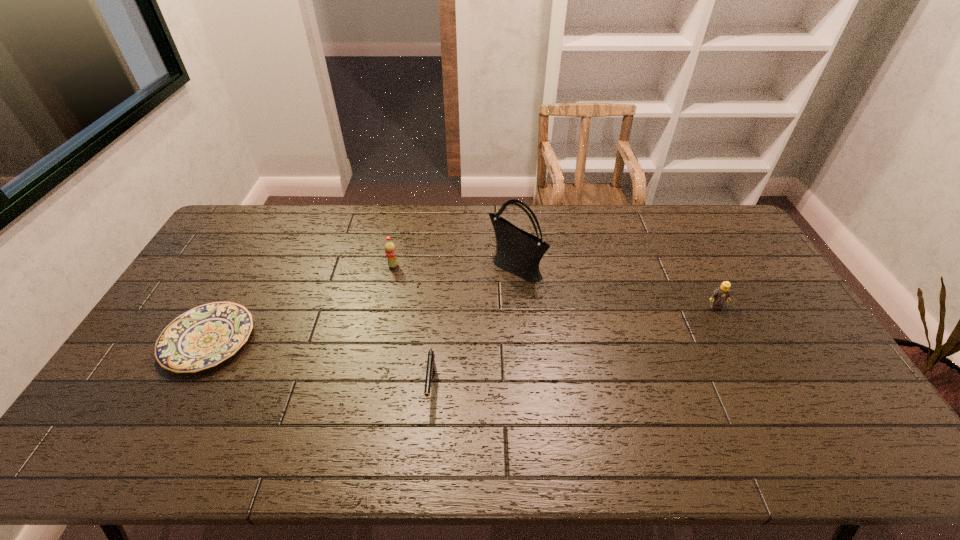
Identify the location of unoccupied area between the rightmost object and the pistol. The image size is (960, 540). (573, 347).

Locate an element on the screen. The height and width of the screenshot is (540, 960). empty space between the tallest object and the pistol is located at coordinates (473, 328).

You are a GUI agent. You are given a task and a screenshot of the screen. Output one action in this format:
    pyautogui.click(x=<x>, y=<y>)
    Task: Click on the vacant region between the second tallest object and the pistol
    
    Given the screenshot: What is the action you would take?
    pyautogui.click(x=413, y=327)

You are a GUI agent. You are given a task and a screenshot of the screen. Output one action in this format:
    pyautogui.click(x=<x>, y=<y>)
    Task: Click on the fourth closest object to the third tallest object
    
    Given the screenshot: What is the action you would take?
    pyautogui.click(x=203, y=337)

Locate which object is the fourth closest to the leftmost object. Please provide its 2D coordinates. Your answer should be formatted as a tuple, i.e. [(x, y)], where the tuple contains the x and y coordinates of a point satisfying the conditions above.

[(721, 294)]

Image resolution: width=960 pixels, height=540 pixels. Identify the location of vacant space that satisfies the following two spatial constraints: 1. on the front side of the shoulder bag; 2. on the right side of the fourth shortest object. (393, 268).